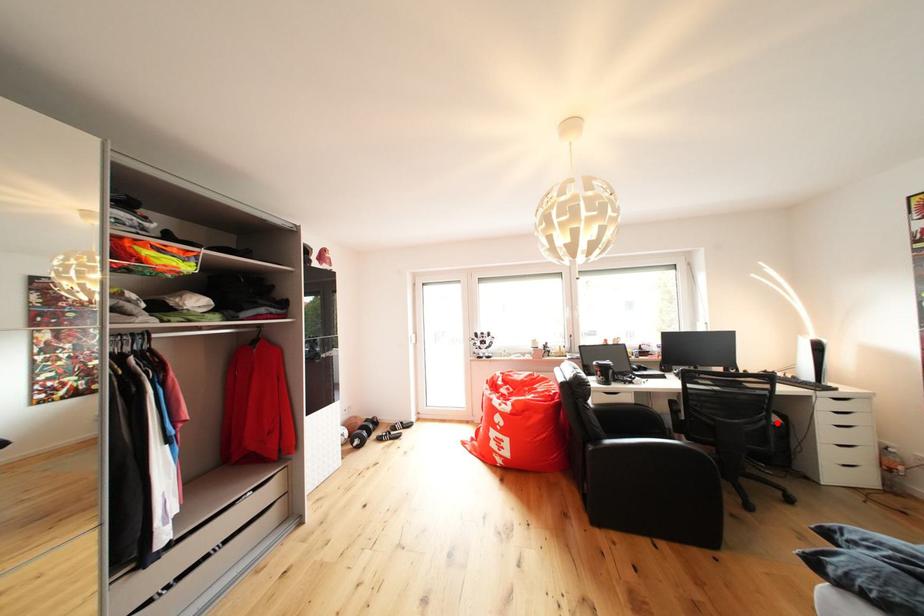
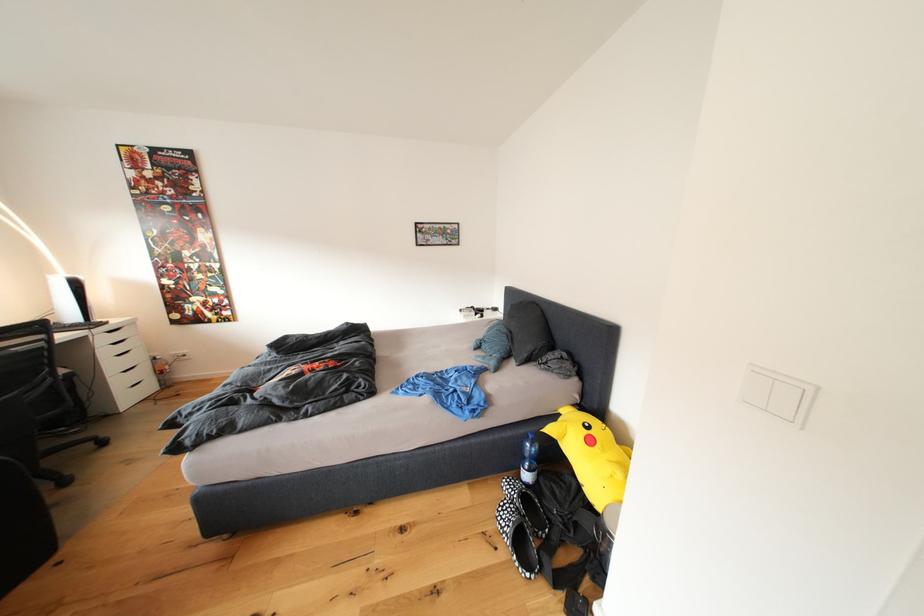
Question: I am providing you with two images of the same scene from different viewpoints. Given a red point in image1, look at the same physical point in image2. Is it:

Choices:
 (A) Closer to the viewpoint
 (B) Farther from the viewpoint

Answer: (B)